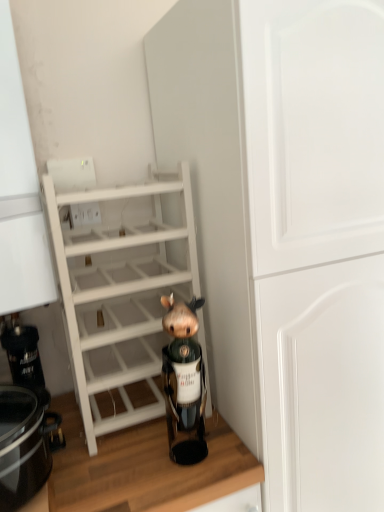
Find the location of a particular element. This screenshot has height=512, width=384. vacant area situated below white wood shelf at center (from a real-world perspective) is located at coordinates (127, 402).